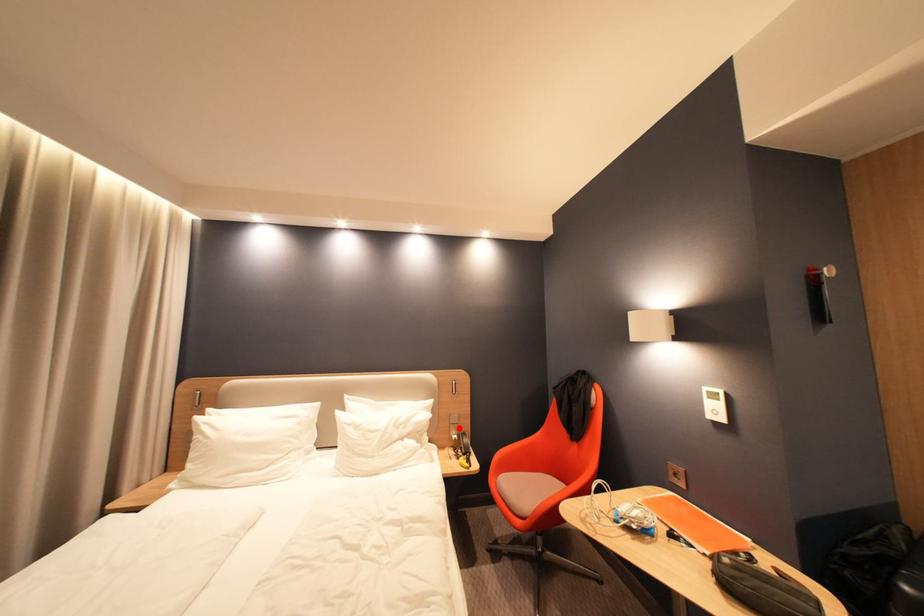
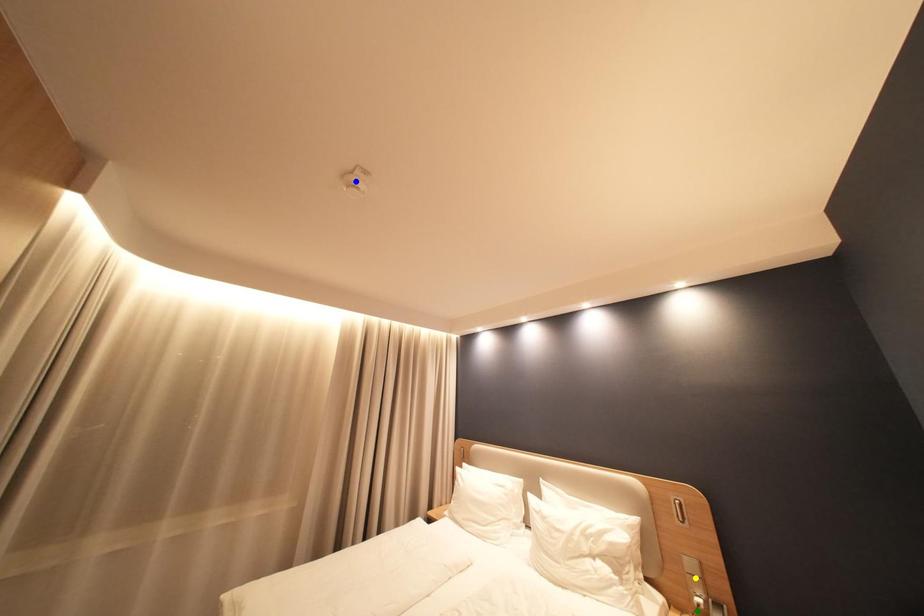
Question: I am providing you with two images of the same scene from different viewpoints. A red point is marked on the first image. You are given multiple points on the second image. Which point in image 2 is actually the same real-world point as the red point in image 1?

Choices:
 (A) green point
 (B) blue point
 (C) yellow point

Answer: (C)